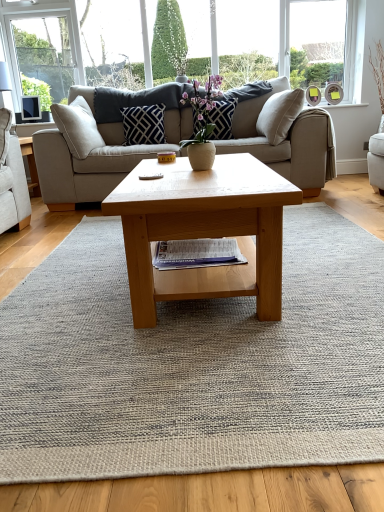
Question: Considering the relative positions of beige fabric couch at center and matte black pillow at center, arranged as the 2th pillow when viewed from the left, in the image provided, is beige fabric couch at center to the right of matte black pillow at center, arranged as the 2th pillow when viewed from the left, from the viewer's perspective?

Choices:
 (A) no
 (B) yes

Answer: (A)

Question: From the image's perspective, is beige fabric couch at center above matte black pillow at center, arranged as the 2th pillow when viewed from the left?

Choices:
 (A) no
 (B) yes

Answer: (A)

Question: Is beige fabric couch at center positioned far away from matte black pillow at center, arranged as the 2th pillow when viewed from the left?

Choices:
 (A) yes
 (B) no

Answer: (B)

Question: Is beige fabric couch at center aimed at matte black pillow at center, arranged as the 2th pillow when viewed from the left?

Choices:
 (A) no
 (B) yes

Answer: (B)

Question: Can we say beige fabric couch at center lies outside matte black pillow at center, which ranks as the 1th pillow in right-to-left order?

Choices:
 (A) no
 (B) yes

Answer: (B)

Question: Considering the relative sizes of beige fabric couch at center and matte black pillow at center, which ranks as the 1th pillow in right-to-left order, in the image provided, is beige fabric couch at center bigger than matte black pillow at center, which ranks as the 1th pillow in right-to-left order,?

Choices:
 (A) yes
 (B) no

Answer: (A)

Question: Does light brown wooden coffee table at center have a lesser height compared to navy blue textured pillow at upper center, positioned as the 1th pillow in left-to-right order?

Choices:
 (A) no
 (B) yes

Answer: (A)

Question: Are light brown wooden coffee table at center and navy blue textured pillow at upper center, positioned as the 1th pillow in left-to-right order, far apart?

Choices:
 (A) no
 (B) yes

Answer: (B)

Question: Considering the relative sizes of light brown wooden coffee table at center and navy blue textured pillow at upper center, positioned as the 1th pillow in left-to-right order, in the image provided, is light brown wooden coffee table at center thinner than navy blue textured pillow at upper center, positioned as the 1th pillow in left-to-right order,?

Choices:
 (A) yes
 (B) no

Answer: (B)

Question: Is light brown wooden coffee table at center positioned in front of navy blue textured pillow at upper center, which ranks as the second pillow in right-to-left order?

Choices:
 (A) no
 (B) yes

Answer: (B)

Question: Is light brown wooden coffee table at center not within navy blue textured pillow at upper center, positioned as the 1th pillow in left-to-right order?

Choices:
 (A) yes
 (B) no

Answer: (A)

Question: From the image's perspective, is light brown wooden coffee table at center over navy blue textured pillow at upper center, which ranks as the second pillow in right-to-left order?

Choices:
 (A) no
 (B) yes

Answer: (A)

Question: Could you tell me if light brown wooden coffee table at center is turned towards neutral woven rug at center?

Choices:
 (A) yes
 (B) no

Answer: (B)